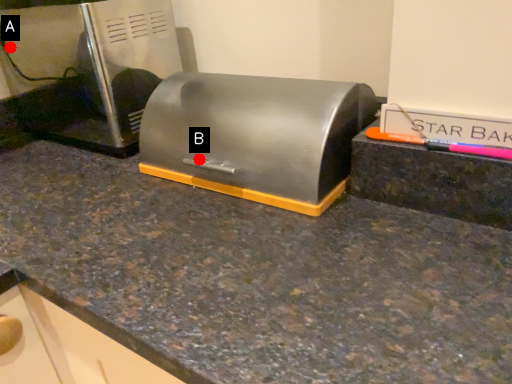
Question: Two points are circled on the image, labeled by A and B beside each circle. Which of the following is the closest to the observer?

Choices:
 (A) A is closer
 (B) B is closer

Answer: (B)